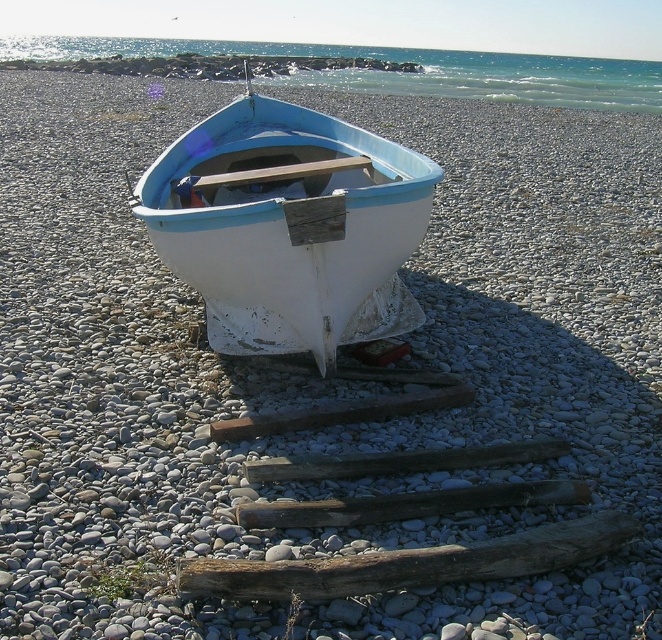
You are standing on the pebble beach and see the white matte boat at center and the weathered wood log at center. Which object is closer to your left side?

The white matte boat at center is to the left of the weathered wood log at center, so it is closer to your left side.